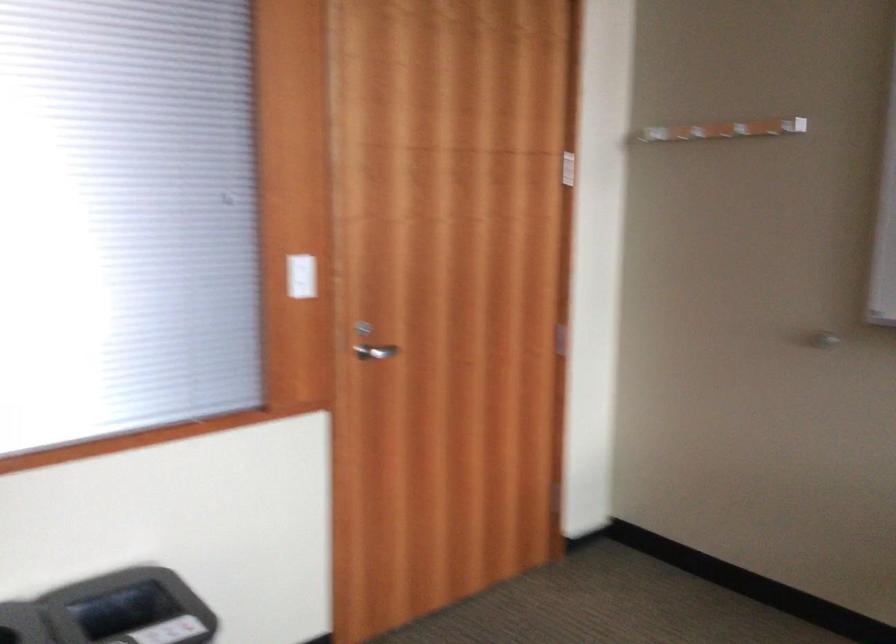
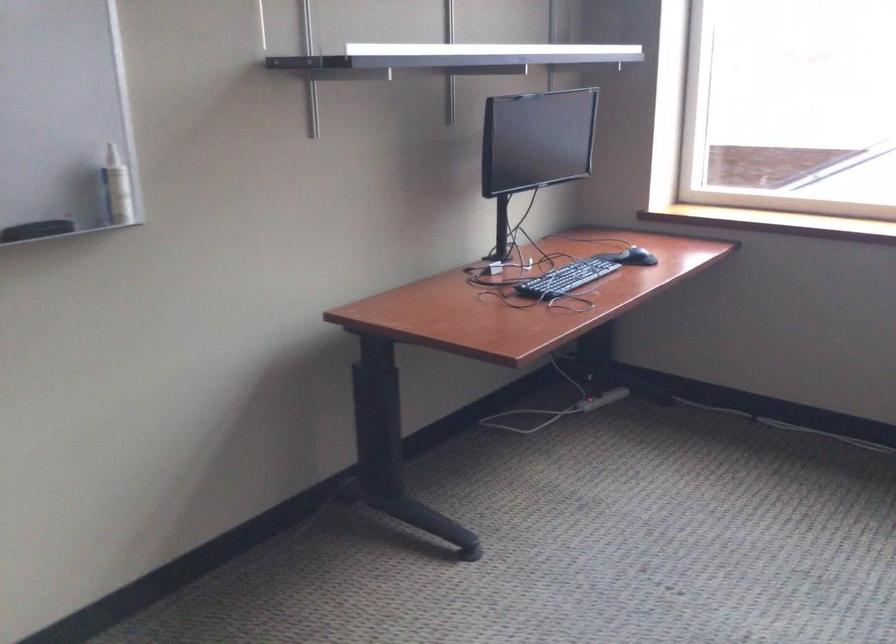
Based on the continuous images, in which direction is the camera rotating?

The rotation direction of the camera is right-down.